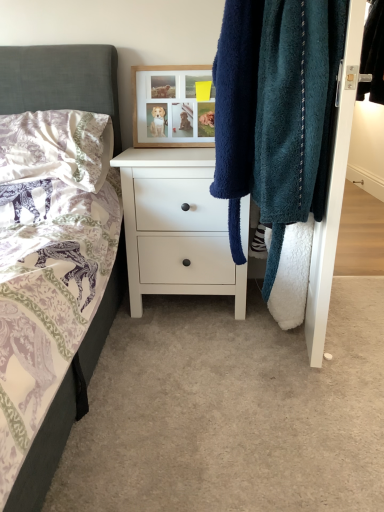
Question: Would you say wooden picture frame at upper center is inside or outside teal fuzzy towel at right?

Choices:
 (A) inside
 (B) outside

Answer: (B)

Question: Is wooden picture frame at upper center bigger or smaller than teal fuzzy towel at right?

Choices:
 (A) small
 (B) big

Answer: (A)

Question: Which object is positioned closest to the wooden picture frame at upper center?

Choices:
 (A) white matte chest of drawers at center
 (B) black leather jacket at upper right
 (C) teal fuzzy towel at right
 (D) white textured pillow at upper left

Answer: (D)

Question: Which of these objects is positioned closest to the black leather jacket at upper right?

Choices:
 (A) white textured pillow at upper left
 (B) teal fuzzy towel at right
 (C) wooden picture frame at upper center
 (D) white matte chest of drawers at center

Answer: (B)